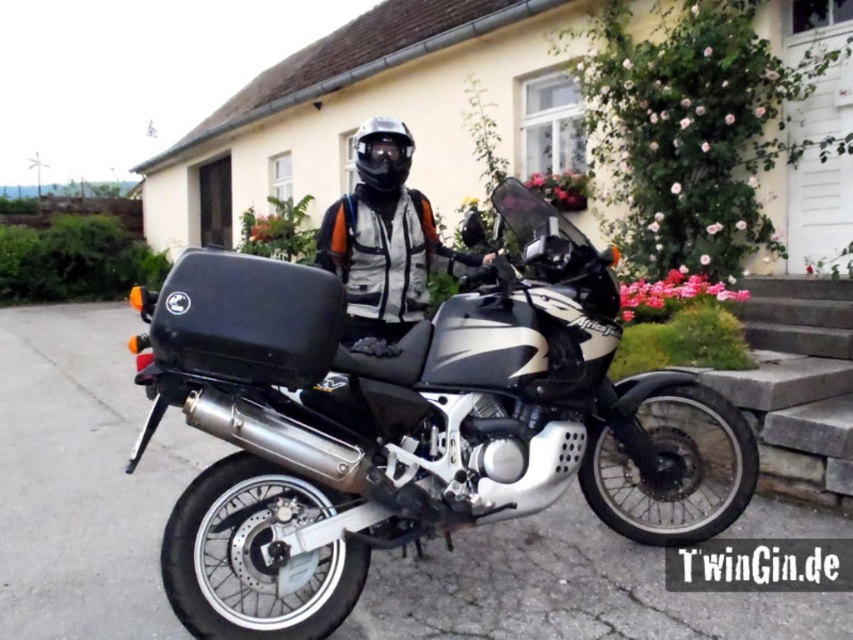
Can you confirm if black matte helmet at center is thinner than transparent plastic goggles at center?

Correct, black matte helmet at center's width is less than transparent plastic goggles at center's.

Between point (373, 122) and point (395, 154), which one is positioned behind?

The point (373, 122) is more distant.

Is point (364, 168) more distant than point (376, 132)?

Yes.

Find the location of `black matte helmet at center`. black matte helmet at center is located at coordinates (381, 152).

From the picture: Which is more to the left, matte black helmet at center or black matte helmet at center?

black matte helmet at center

Does matte black helmet at center have a lesser width compared to black matte helmet at center?

Incorrect, matte black helmet at center's width is not less than black matte helmet at center's.

Where is `matte black helmet at center`? The height and width of the screenshot is (640, 853). matte black helmet at center is located at coordinates (383, 252).

Where is `matte black helmet at center`? The width and height of the screenshot is (853, 640). matte black helmet at center is located at coordinates (383, 252).

Who is positioned more to the left, silver metallic motorcycle at center or matte black helmet at center?

matte black helmet at center is more to the left.

Identify the location of silver metallic motorcycle at center. (407, 422).

Which is in front, point (425, 524) or point (374, 264)?

Point (425, 524) is more forward.

This screenshot has height=640, width=853. In order to click on silver metallic motorcycle at center in this screenshot , I will do `click(407, 422)`.